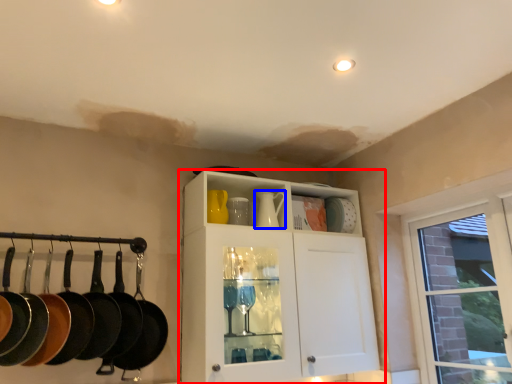
Question: Which point is closer to the camera, cabinetry (highlighted by a red box) or tea pot (highlighted by a blue box)?

Choices:
 (A) cabinetry
 (B) tea pot

Answer: (A)